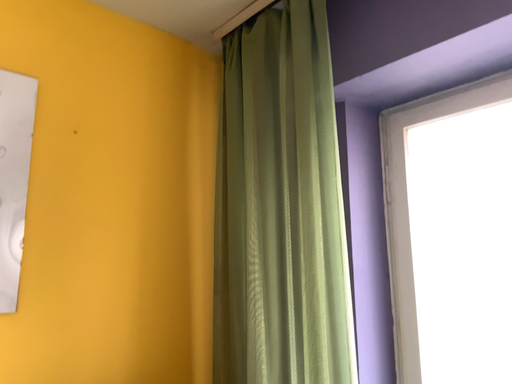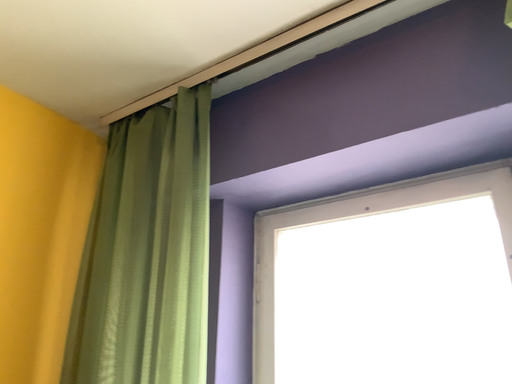
Question: Which way did the camera rotate in the video?

Choices:
 (A) rotated left
 (B) rotated right

Answer: (B)